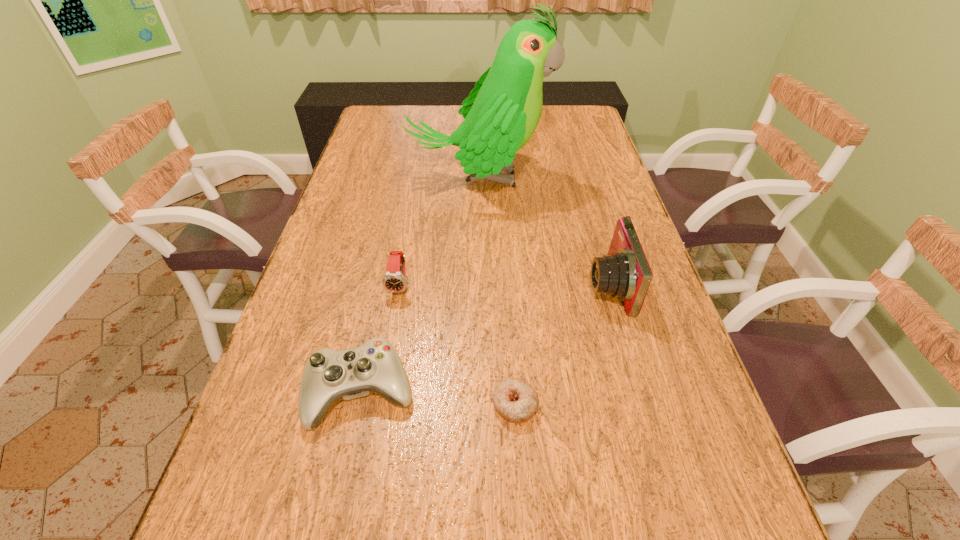
What are the coordinates of `free space between the camera and the farthest object` in the screenshot? It's located at (543, 232).

Where is `free spot between the farthest object and the watch`? Image resolution: width=960 pixels, height=540 pixels. free spot between the farthest object and the watch is located at coordinates (440, 232).

You are a GUI agent. You are given a task and a screenshot of the screen. Output one action in this format:
    pyautogui.click(x=<x>, y=<y>)
    Task: Click on the free space that is in between the watch and the doughnut
    This screenshot has height=540, width=960.
    Given the screenshot: What is the action you would take?
    pyautogui.click(x=458, y=345)

Locate an element on the screen. This screenshot has height=540, width=960. vacant space that is in between the control and the farthest object is located at coordinates click(x=420, y=285).

You are a GUI agent. You are given a task and a screenshot of the screen. Output one action in this format:
    pyautogui.click(x=<x>, y=<y>)
    Task: Click on the empty space between the camera and the parakeet
    
    Given the screenshot: What is the action you would take?
    pyautogui.click(x=543, y=232)

Where is `free point between the doughnut and the tallest object`? free point between the doughnut and the tallest object is located at coordinates (497, 292).

Select which object is the closest to the control. Please provide its 2D coordinates. Your answer should be formatted as a tuple, i.e. [(x, y)], where the tuple contains the x and y coordinates of a point satisfying the conditions above.

[(515, 399)]

Choose which object is the third nearest neighbor to the farthest object. Please provide its 2D coordinates. Your answer should be formatted as a tuple, i.e. [(x, y)], where the tuple contains the x and y coordinates of a point satisfying the conditions above.

[(375, 366)]

The width and height of the screenshot is (960, 540). Find the location of `vacant space that satisfies the following two spatial constraints: 1. on the beak of the tallest object; 2. on the back side of the shortest object`. vacant space that satisfies the following two spatial constraints: 1. on the beak of the tallest object; 2. on the back side of the shortest object is located at coordinates (478, 404).